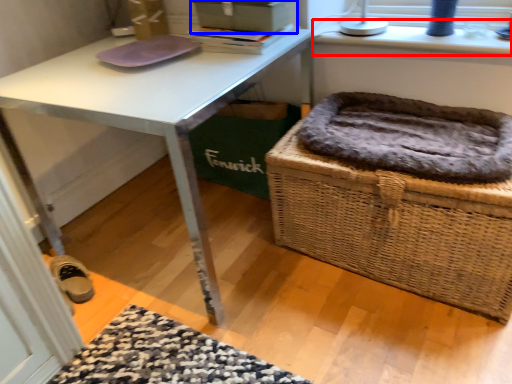
Question: Which object appears farthest to the camera in this image, window sill (highlighted by a red box) or box (highlighted by a blue box)?

Choices:
 (A) window sill
 (B) box

Answer: (A)